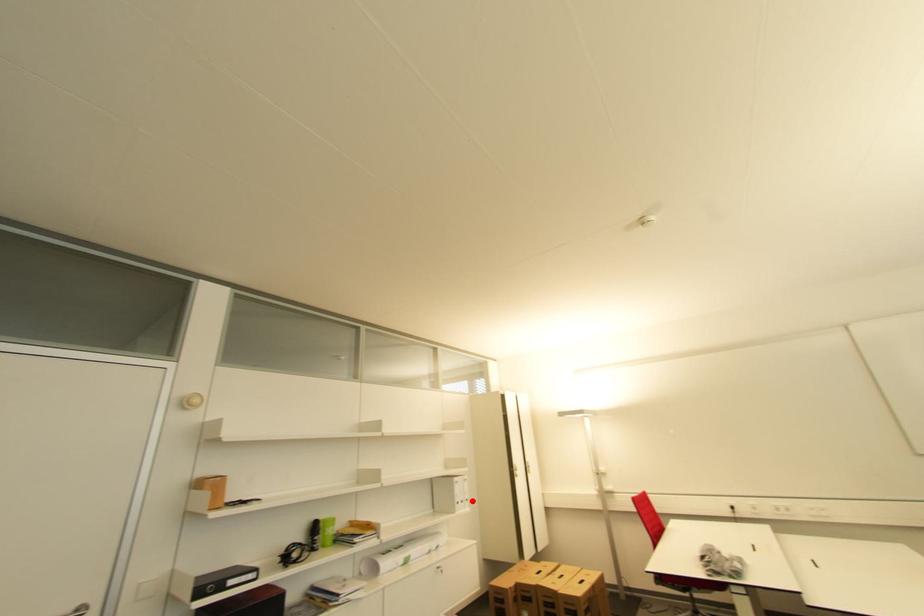
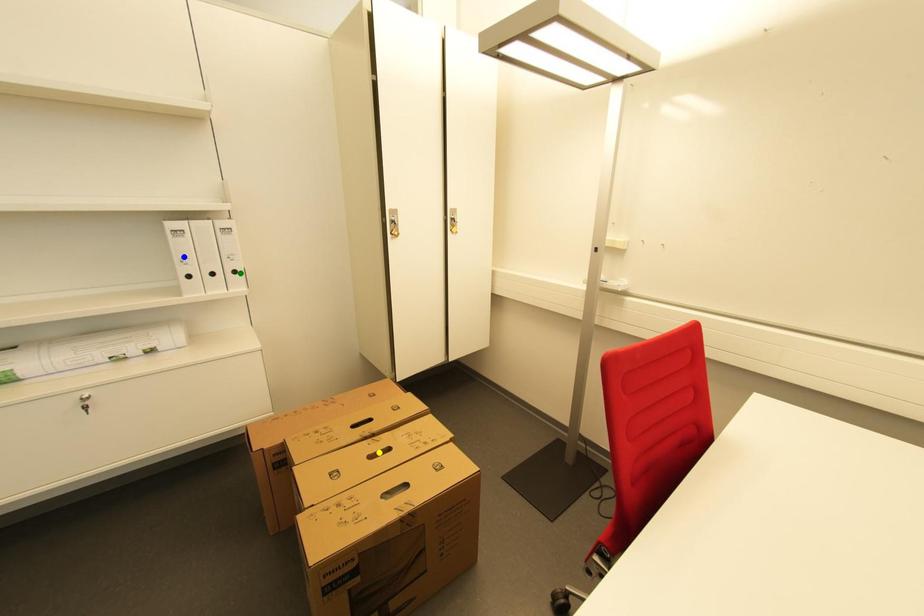
Question: I am providing you with two images of the same scene from different viewpoints. A red point is marked on the first image. You are given multiple points on the second image. Can you choose the point in image 2 that corresponds to the point in image 1?

Choices:
 (A) blue point
 (B) yellow point
 (C) green point

Answer: (C)